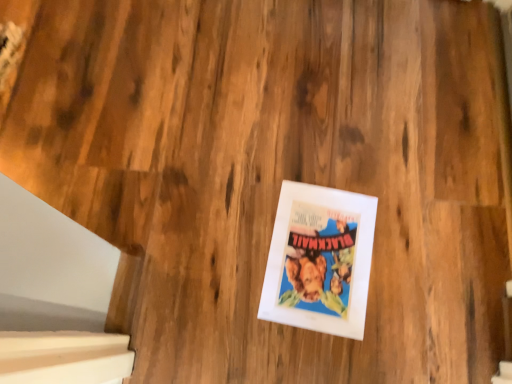
Find the location of a particular element. vacant space to the right of white matte picture frame at center is located at coordinates (407, 253).